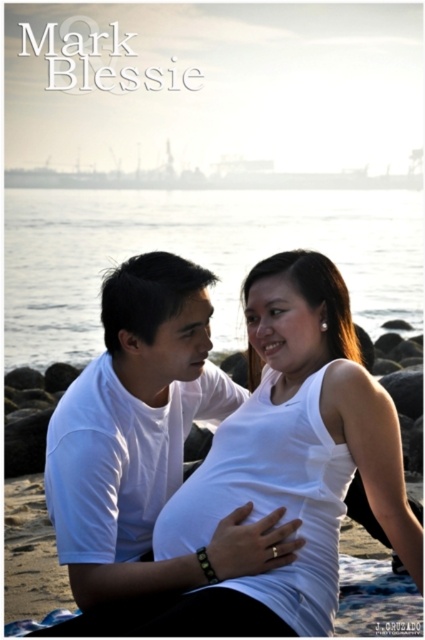
How distant is white matte t-shirt at center from white smooth tank top at center?

The distance of white matte t-shirt at center from white smooth tank top at center is 3.07 meters.

Is white matte t-shirt at center positioned at the back of white smooth tank top at center?

Yes, white matte t-shirt at center is behind white smooth tank top at center.

The height and width of the screenshot is (640, 425). Describe the element at coordinates (146, 460) in the screenshot. I see `white matte t-shirt at center` at that location.

At what (x,y) coordinates should I click in order to perform the action: click on white matte t-shirt at center. Please return your answer as a coordinate pair (x, y). Image resolution: width=425 pixels, height=640 pixels. Looking at the image, I should click on (146, 460).

Is point (393, 465) positioned in front of point (19, 330)?

Yes, it is in front of point (19, 330).

Is point (328, 540) in front of point (167, 248)?

Yes, it is in front of point (167, 248).

The image size is (425, 640). What are the coordinates of `white smooth tank top at center` in the screenshot? It's located at (299, 445).

Is white matte t-shirt at center in front of clear water at center?

Yes.

Locate an element on the screen. The height and width of the screenshot is (640, 425). white matte t-shirt at center is located at coordinates (146, 460).

The width and height of the screenshot is (425, 640). I want to click on white matte t-shirt at center, so click(146, 460).